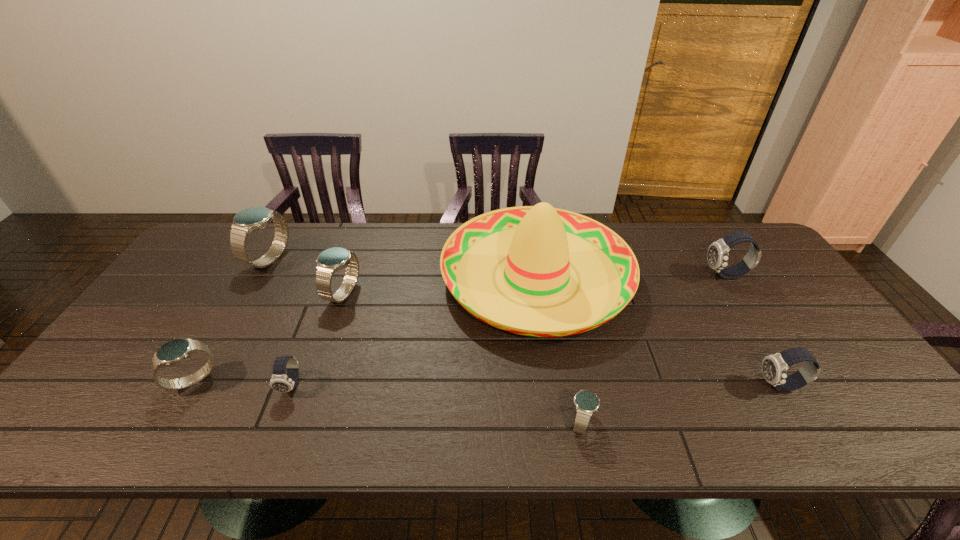
What are the coordinates of `sombrero` in the screenshot? It's located at (541, 243).

Identify the location of the tallest object. This screenshot has width=960, height=540. (541, 243).

Find the location of a particular element. the biggest blue watch is located at coordinates (250, 219).

Locate an element on the screen. the farthest dark watch is located at coordinates (717, 256).

Locate an element on the screen. The height and width of the screenshot is (540, 960). the third smallest blue watch is located at coordinates (329, 261).

At what (x,y) coordinates should I click in order to perform the action: click on the second biggest dark watch. Please return your answer as a coordinate pair (x, y). The width and height of the screenshot is (960, 540). Looking at the image, I should click on (774, 367).

Locate an element on the screen. This screenshot has height=540, width=960. the second smallest blue watch is located at coordinates (175, 351).

The width and height of the screenshot is (960, 540). Find the location of `the smallest dark watch`. the smallest dark watch is located at coordinates (280, 382).

You are a GUI agent. You are given a task and a screenshot of the screen. Output one action in this format:
    pyautogui.click(x=<x>, y=<y>)
    Task: Click on the rightmost blue watch
    
    Given the screenshot: What is the action you would take?
    pyautogui.click(x=586, y=403)

Where is `the smallest blue watch`? The width and height of the screenshot is (960, 540). the smallest blue watch is located at coordinates (586, 403).